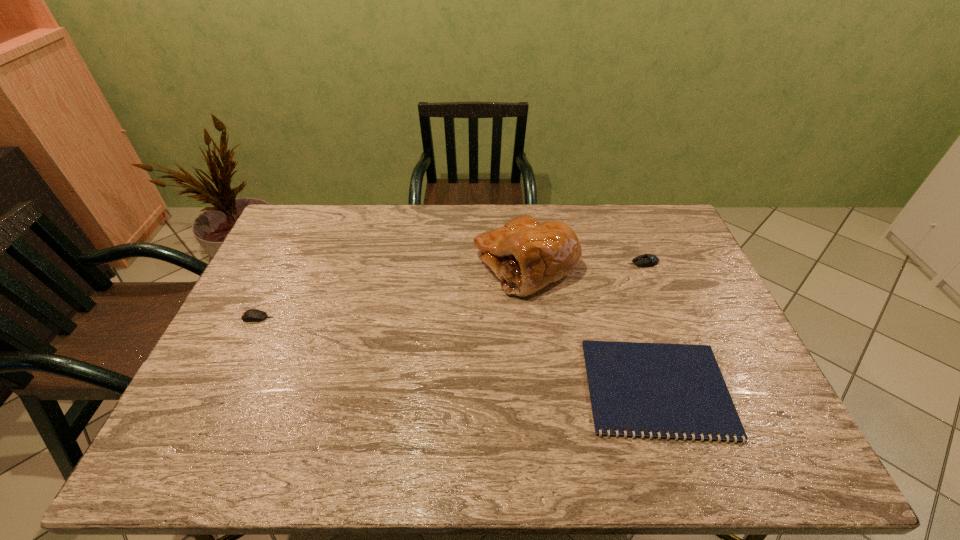
Find the location of a particular element. free space located on the front of the shorter computer mouse is located at coordinates (239, 356).

The width and height of the screenshot is (960, 540). Find the location of `vacant area situated on the left of the nearest object`. vacant area situated on the left of the nearest object is located at coordinates (469, 389).

Identify the location of object present at the far edge. (526, 255).

This screenshot has width=960, height=540. Find the location of `object that is at the near edge`. object that is at the near edge is located at coordinates (675, 388).

Locate an element on the screen. The width and height of the screenshot is (960, 540). object that is positioned at the left edge is located at coordinates (252, 315).

Find the location of a particular element. This screenshot has height=540, width=960. computer mouse that is at the right edge is located at coordinates (646, 260).

Locate an element on the screen. Image resolution: width=960 pixels, height=540 pixels. notepad present at the right edge is located at coordinates (675, 388).

Where is `object present at the near right corner`? This screenshot has width=960, height=540. object present at the near right corner is located at coordinates (675, 388).

Find the location of a particular element. This screenshot has width=960, height=540. free region at the far edge is located at coordinates (398, 226).

The width and height of the screenshot is (960, 540). Find the location of `free space at the near edge of the desktop`. free space at the near edge of the desktop is located at coordinates (x=351, y=444).